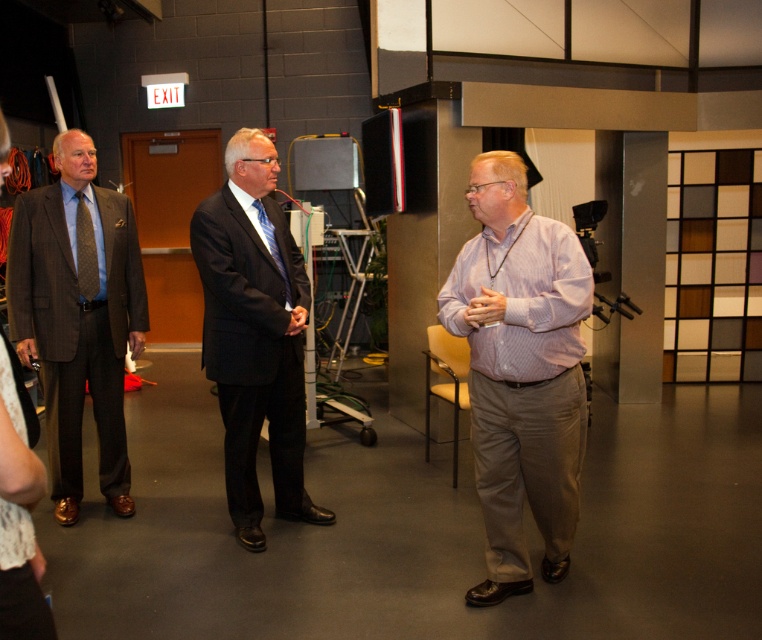
Question: Where is brown textured tie at left located in relation to blue striped tie at center in the image?

Choices:
 (A) right
 (B) left

Answer: (B)

Question: Can you confirm if matte black suit at center is bigger than brown textured tie at left?

Choices:
 (A) yes
 (B) no

Answer: (A)

Question: Which of these objects is positioned farthest from the matte brown suit at left?

Choices:
 (A) blue striped tie at center
 (B) pink textured shirt at center
 (C) brown textured tie at left

Answer: (B)

Question: Which of these objects is positioned closest to the pink textured shirt at center?

Choices:
 (A) matte brown suit at left
 (B) matte black suit at center
 (C) brown textured tie at left

Answer: (B)

Question: Does brown textured tie at left have a lesser width compared to blue striped tie at center?

Choices:
 (A) no
 (B) yes

Answer: (B)

Question: Which of the following is the closest to the observer?

Choices:
 (A) (127, 460)
 (B) (95, 259)
 (C) (255, 429)

Answer: (C)